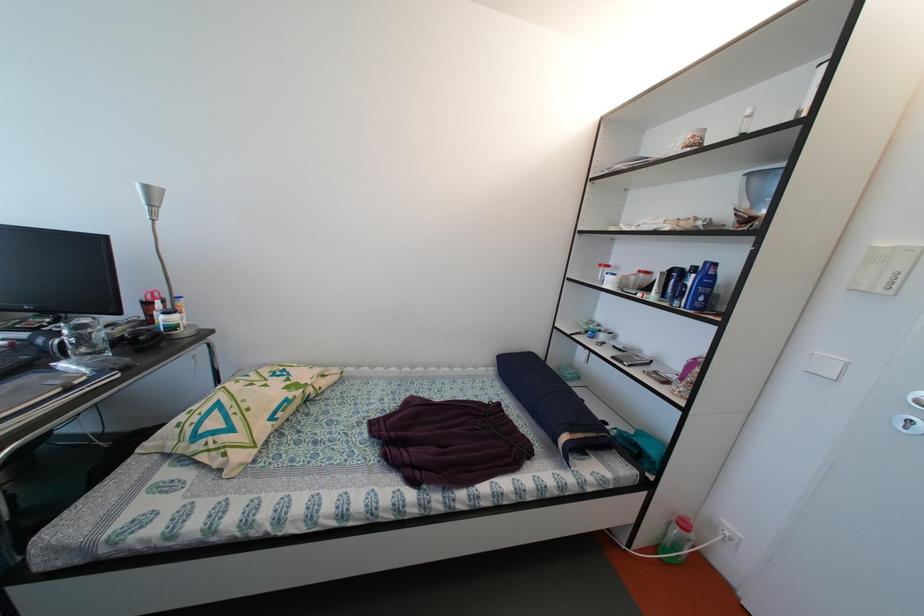
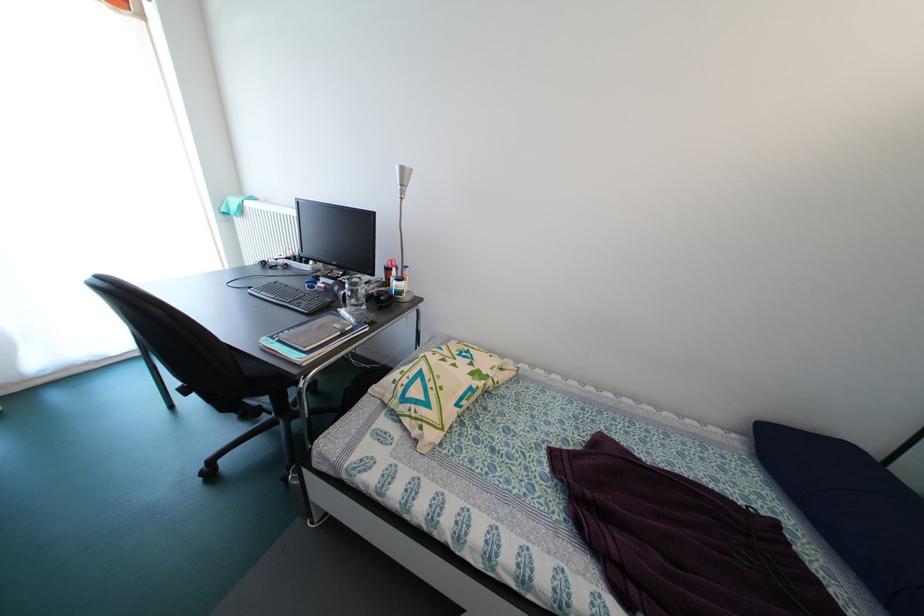
Find the pixel in the second image that matches the point at 47,346 in the first image.

(344, 294)